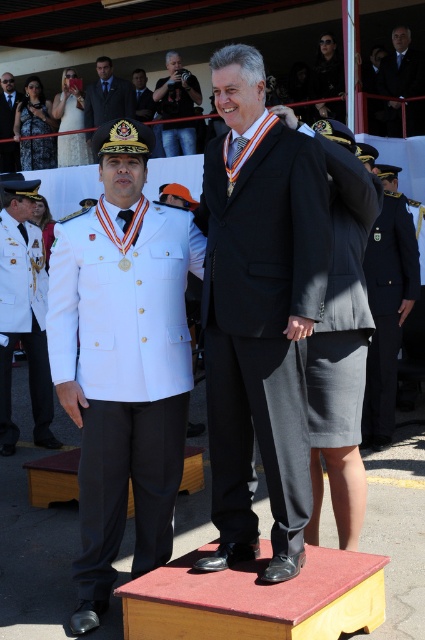
You are a photographer at the event and need to capture a photo that includes both the navy blue fabric uniform at right and the white satin dress at upper left. Which object should you focus on first to ensure both are in frame?

You should focus on the navy blue fabric uniform at right first since it is located below the white satin dress at upper left, allowing you to adjust the camera angle to include both objects in the frame.

You are a photographer at the event and need to capture a photo of both the black satin suit at center and the matte black dress at upper left. Which one should you focus on first if you want to ensure both fit in the frame without zooming?

You should focus on the matte black dress at upper left first because the black satin suit at center is narrower than the matte black dress at upper left, so starting with the wider object ensures it fits better in the frame.